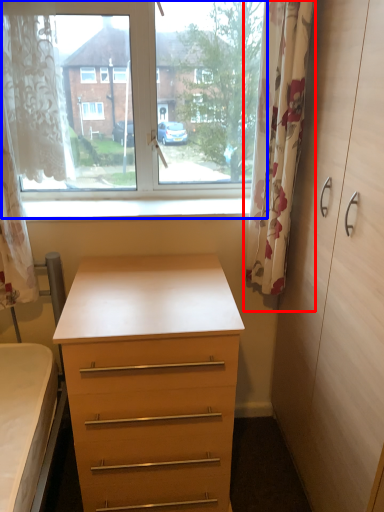
Question: Which point is further to the camera, curtain (highlighted by a red box) or window (highlighted by a blue box)?

Choices:
 (A) curtain
 (B) window

Answer: (B)